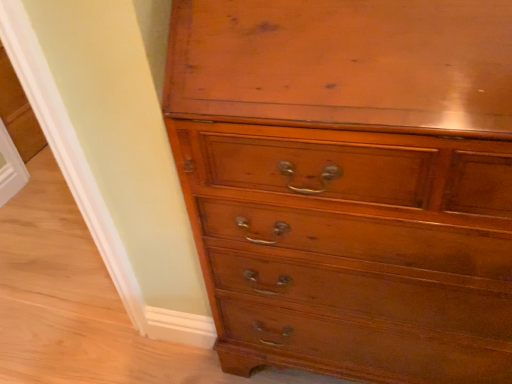
Question: In which direction should I rotate to look at shiny brown wood chest of drawers at center?

Choices:
 (A) right
 (B) left

Answer: (A)

Question: Should I look upward or downward to see white plastic screen door at lower left?

Choices:
 (A) down
 (B) up

Answer: (A)

Question: Is white plastic screen door at lower left outside of shiny brown wood chest of drawers at center?

Choices:
 (A) no
 (B) yes

Answer: (B)

Question: Is white plastic screen door at lower left facing away from shiny brown wood chest of drawers at center?

Choices:
 (A) no
 (B) yes

Answer: (A)

Question: Is the position of white plastic screen door at lower left less distant than that of shiny brown wood chest of drawers at center?

Choices:
 (A) yes
 (B) no

Answer: (B)

Question: Does white plastic screen door at lower left have a lesser width compared to shiny brown wood chest of drawers at center?

Choices:
 (A) yes
 (B) no

Answer: (A)

Question: From a real-world perspective, is white plastic screen door at lower left positioned over shiny brown wood chest of drawers at center based on gravity?

Choices:
 (A) no
 (B) yes

Answer: (A)

Question: Does white plastic screen door at lower left have a greater width compared to shiny brown wood chest of drawers at center?

Choices:
 (A) no
 (B) yes

Answer: (A)

Question: Is shiny brown wood chest of drawers at center to the left of white plastic screen door at lower left from the viewer's perspective?

Choices:
 (A) no
 (B) yes

Answer: (A)

Question: Is shiny brown wood chest of drawers at center closer to the viewer compared to white plastic screen door at lower left?

Choices:
 (A) yes
 (B) no

Answer: (A)

Question: Is shiny brown wood chest of drawers at center outside white plastic screen door at lower left?

Choices:
 (A) no
 (B) yes

Answer: (B)

Question: From a real-world perspective, is shiny brown wood chest of drawers at center located higher than white plastic screen door at lower left?

Choices:
 (A) yes
 (B) no

Answer: (A)

Question: From a real-world perspective, is shiny brown wood chest of drawers at center located beneath white plastic screen door at lower left?

Choices:
 (A) no
 (B) yes

Answer: (A)

Question: Would you say shiny brown wood chest of drawers at center is a long distance from white plastic screen door at lower left?

Choices:
 (A) no
 (B) yes

Answer: (B)

Question: In terms of size, does shiny brown wood chest of drawers at center appear bigger or smaller than white plastic screen door at lower left?

Choices:
 (A) small
 (B) big

Answer: (B)